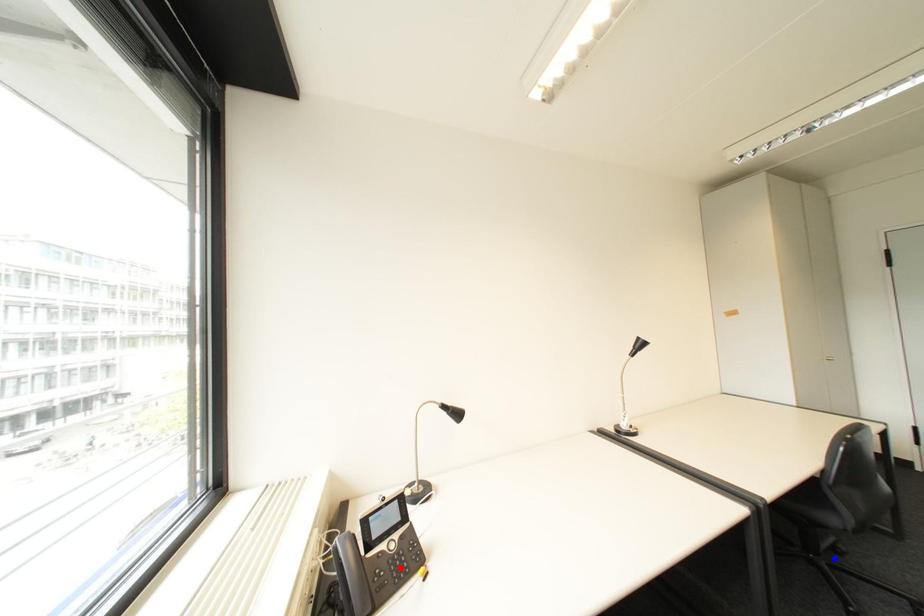
Question: Which of the two points in the image is closer to the camera?

Choices:
 (A) Blue point is closer.
 (B) Red point is closer.

Answer: (B)